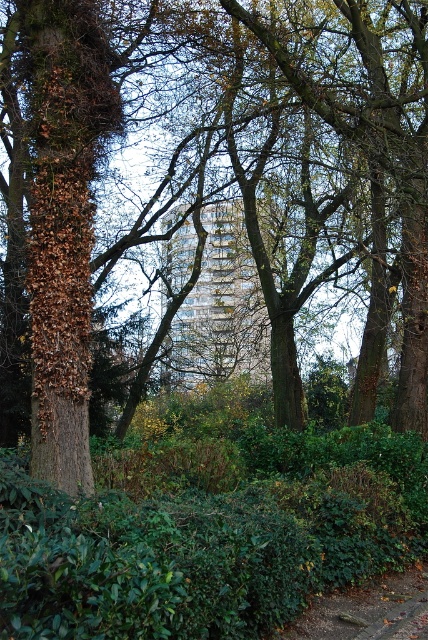
You are standing in the park and want to reach the point marked at coordinates [192,362]. The park has a walking path that is 2 meters wide. Can you walk directly to that point without stepping off the path?

The point marked at coordinates [192,362] is 23.80 meters away from you. Since the walking path is 2 meters wide, you can walk directly to that point as long as the path extends straight towards it without any obstacles. However, the description does not mention the path layout, so assume the path allows direct access.

You are planning to take a photo of the glassy reflective building at center and the brown gravel path at lower center. Which object should you focus on first if you want to capture both in a single shot without moving the camera?

You should focus on the glassy reflective building at center first because it is taller than the brown gravel path at lower center, so it will require adjusting the camera angle to include its full height while still capturing the path below.